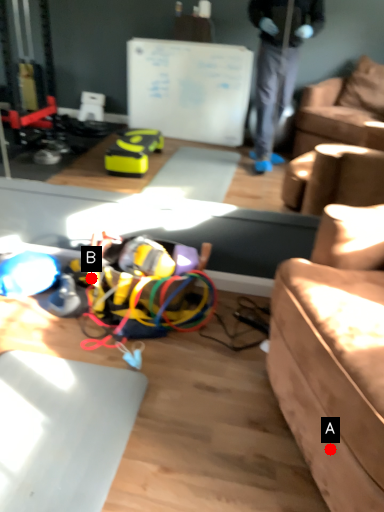
Question: Two points are circled on the image, labeled by A and B beside each circle. Which point appears farthest from the camera in this image?

Choices:
 (A) A is further
 (B) B is further

Answer: (B)